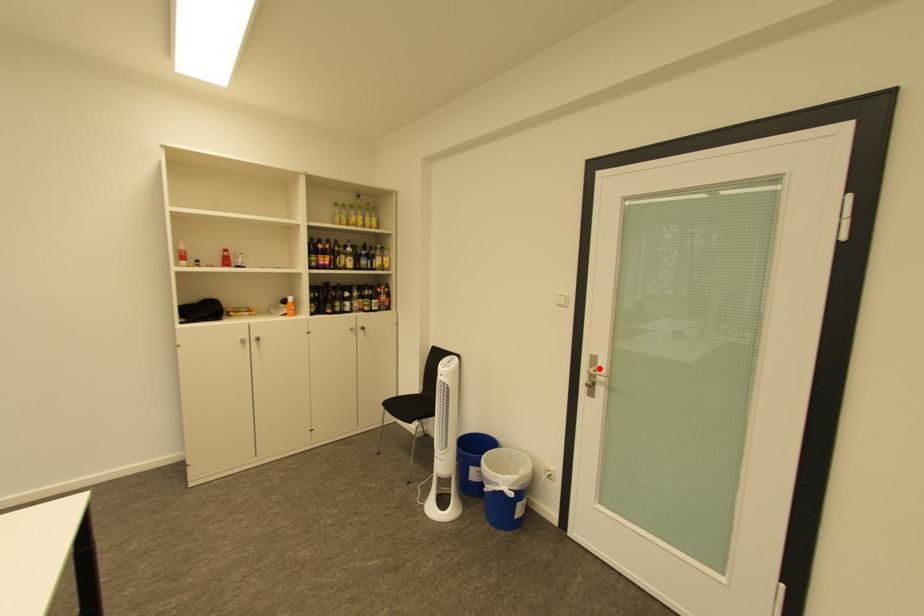
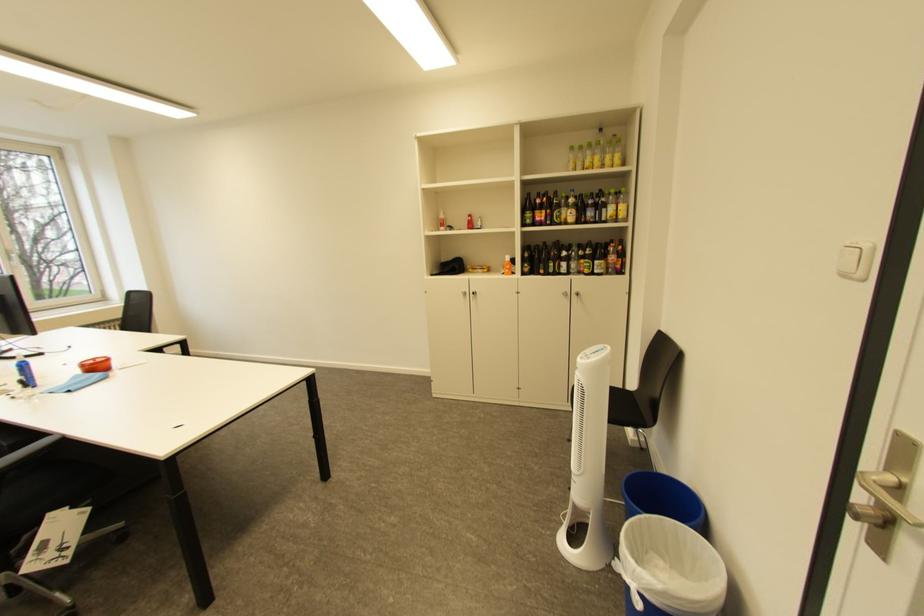
Locate, in the second image, the point that corresponds to the highlighted location in the first image.

(898, 472)